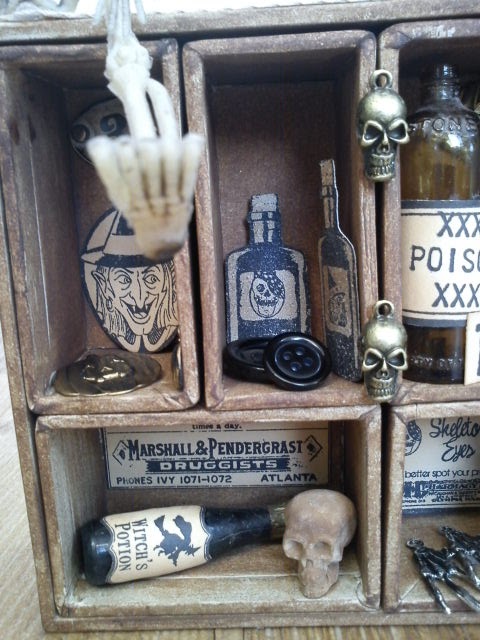
Find the location of a particular element. The image size is (480, 640). edge of box full of cubbyholes is located at coordinates (23, 456).